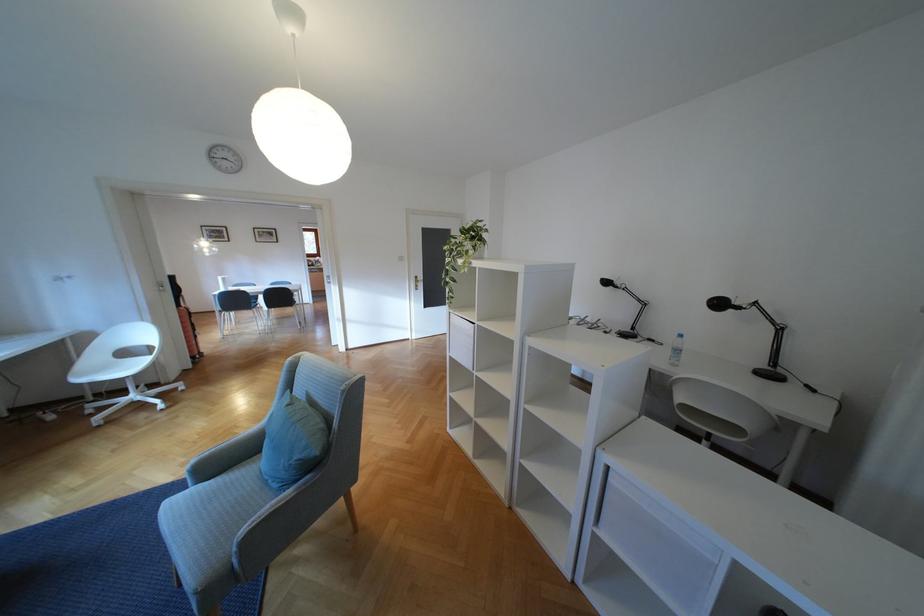
You are a GUI agent. You are given a task and a screenshot of the screen. Output one action in this format:
    pyautogui.click(x=<x>, y=<y>)
    Task: Click on the grey chair sitting surface
    Image resolution: width=924 pixels, height=616 pixels.
    Given the screenshot: What is the action you would take?
    pyautogui.click(x=209, y=521)